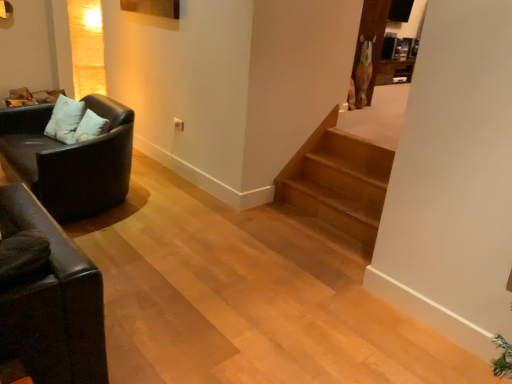
Question: Can you confirm if matte black couch at left is smaller than light brown wooden stairs at center?

Choices:
 (A) no
 (B) yes

Answer: (A)

Question: Is matte black couch at left in contact with light brown wooden stairs at center?

Choices:
 (A) no
 (B) yes

Answer: (A)

Question: Does matte black couch at left have a lesser width compared to light brown wooden stairs at center?

Choices:
 (A) no
 (B) yes

Answer: (A)

Question: From the image's perspective, is matte black couch at left beneath light brown wooden stairs at center?

Choices:
 (A) no
 (B) yes

Answer: (A)

Question: Considering the relative positions of matte black couch at left and light brown wooden stairs at center in the image provided, is matte black couch at left to the right of light brown wooden stairs at center from the viewer's perspective?

Choices:
 (A) no
 (B) yes

Answer: (A)

Question: Is matte black couch at left further to camera compared to light brown wooden stairs at center?

Choices:
 (A) yes
 (B) no

Answer: (B)

Question: Is white soft pillow at left shorter than matte black couch at left?

Choices:
 (A) yes
 (B) no

Answer: (A)

Question: Is white soft pillow at left facing away from matte black couch at left?

Choices:
 (A) yes
 (B) no

Answer: (A)

Question: From the image's perspective, is white soft pillow at left beneath matte black couch at left?

Choices:
 (A) no
 (B) yes

Answer: (A)

Question: Can you confirm if white soft pillow at left is positioned to the left of matte black couch at left?

Choices:
 (A) yes
 (B) no

Answer: (A)

Question: Can you confirm if white soft pillow at left is bigger than matte black couch at left?

Choices:
 (A) yes
 (B) no

Answer: (B)

Question: Is white soft pillow at left outside matte black couch at left?

Choices:
 (A) no
 (B) yes

Answer: (A)

Question: Can we say light brown wooden stairs at center lies outside matte black couch at left?

Choices:
 (A) yes
 (B) no

Answer: (A)